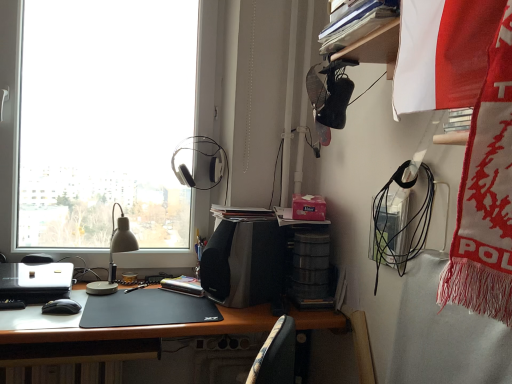
Question: Relative to hardcover book at center, is velvet-like fabric chair at lower center in front or behind?

Choices:
 (A) behind
 (B) front

Answer: (A)

Question: Is velvet-like fabric chair at lower center taller or shorter than hardcover book at center?

Choices:
 (A) tall
 (B) short

Answer: (A)

Question: Which of these objects is positioned closest to the hardcover book at center?

Choices:
 (A) black matte mouse at lower left
 (B) black matte desk at center
 (C) black matte speaker at center
 (D) black plastic chair at lower left
 (E) transparent glass window at upper left

Answer: (C)

Question: Estimate the real-world distances between objects in this image. Which object is closer to the silver metallic laptop at left?

Choices:
 (A) black matte mouse at lower left
 (B) black plastic chair at lower left
 (C) satin black headphones at upper center
 (D) transparent glass window at upper left
 (E) black matte speaker at center

Answer: (B)